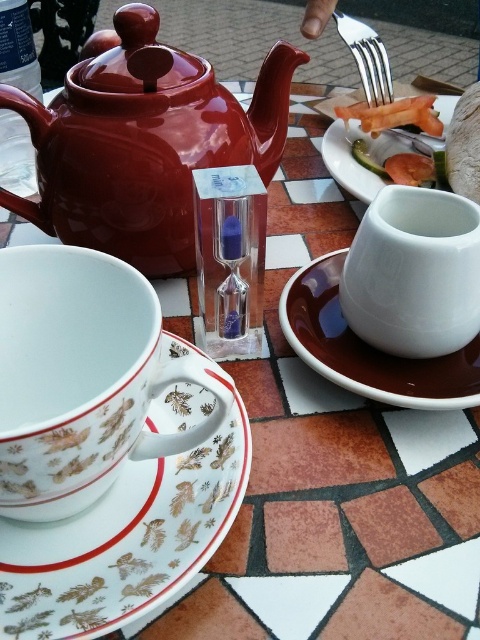
Question: Which point is farther from the camera taking this photo?

Choices:
 (A) (347, 38)
 (B) (57, 200)
 (C) (408, 397)
 (D) (416, 106)

Answer: (D)

Question: Is white porcelain plate at lower left below silver metallic fork at upper right?

Choices:
 (A) yes
 (B) no

Answer: (A)

Question: Which point is closer to the camera?

Choices:
 (A) (372, 180)
 (B) (398, 225)

Answer: (B)

Question: Can you confirm if glossy ceramic teapot at upper left is positioned below white glossy teacup at center?

Choices:
 (A) yes
 (B) no

Answer: (B)

Question: Does brown ceramic saucer at center appear on the left side of shiny plastic fork at upper right?

Choices:
 (A) yes
 (B) no

Answer: (A)

Question: Which object is the farthest from the glossy ceramic teapot at upper left?

Choices:
 (A) white porcelain teacup at center
 (B) white glossy teacup at center

Answer: (A)